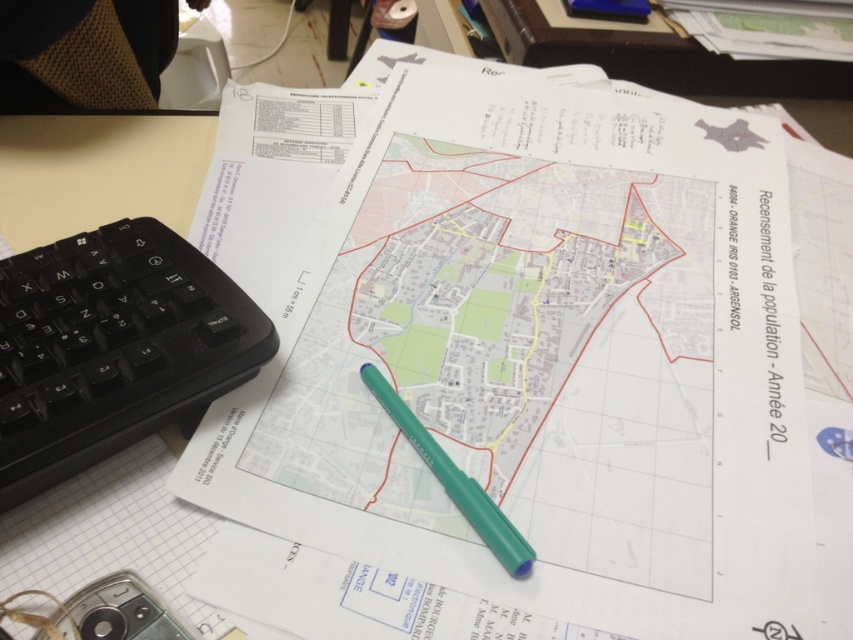
Question: Which point is farther to the camera?

Choices:
 (A) white paper at center
 (B) green plastic pen at center

Answer: (B)

Question: Where is white paper at center located in relation to black plastic keyboard at lower left in the image?

Choices:
 (A) right
 (B) left

Answer: (A)

Question: Can you confirm if white paper at center is wider than black plastic keyboard at lower left?

Choices:
 (A) no
 (B) yes

Answer: (B)

Question: Considering the real-world distances, which object is closest to the white paper at center?

Choices:
 (A) green plastic pen at center
 (B) black plastic keyboard at lower left

Answer: (A)

Question: Which object appears farthest from the camera in this image?

Choices:
 (A) black plastic keyboard at lower left
 (B) white paper at center

Answer: (A)

Question: Can you confirm if white paper at center is thinner than black plastic keyboard at lower left?

Choices:
 (A) yes
 (B) no

Answer: (B)